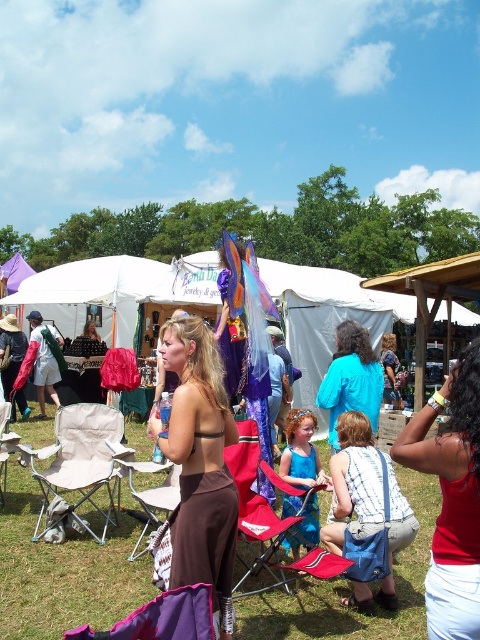
Question: From the image, what is the correct spatial relationship of green grass at lower center in relation to brown fabric skirt at center?

Choices:
 (A) below
 (B) above

Answer: (A)

Question: Which of these objects is positioned closest to the turquoise fabric dress at center?

Choices:
 (A) matte red tank top at lower right
 (B) green grass at lower center
 (C) blue cotton shirt at center

Answer: (C)

Question: Considering the relative positions of green grass at lower center and turquoise fabric dress at center in the image provided, where is green grass at lower center located with respect to turquoise fabric dress at center?

Choices:
 (A) below
 (B) above

Answer: (A)

Question: Which point is closer to the camera taking this photo?

Choices:
 (A) (60, 557)
 (B) (342, 388)
 (C) (268, 586)

Answer: (C)

Question: Estimate the real-world distances between objects in this image. Which object is closer to the blue cotton shirt at center?

Choices:
 (A) green grass at lower center
 (B) turquoise fabric dress at center

Answer: (B)

Question: In this image, where is beige fabric chair at lower left located relative to turquoise fabric dress at center?

Choices:
 (A) below
 (B) above

Answer: (A)